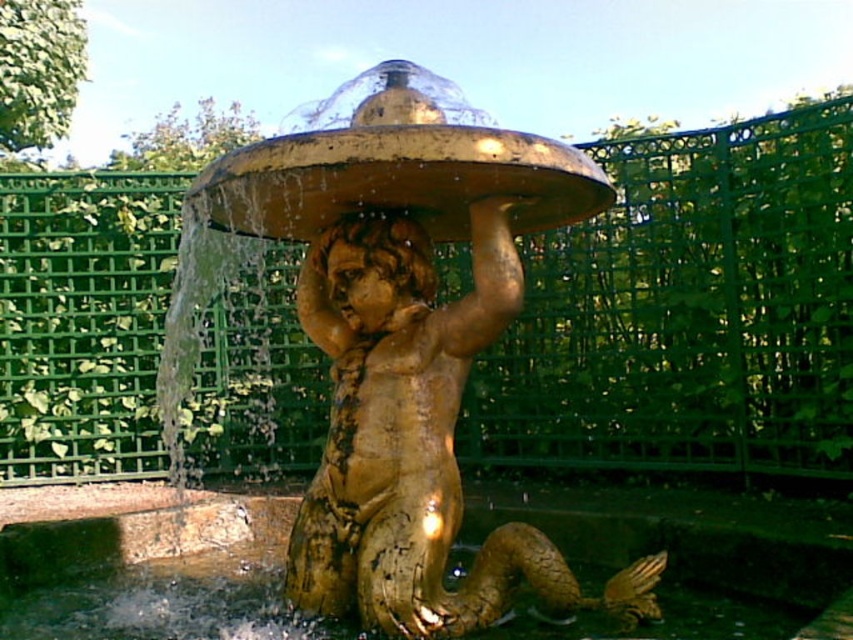
Consider the image. Is gold textured cherub at center smaller than gold metallic water at center?

Actually, gold textured cherub at center might be larger than gold metallic water at center.

Locate an element on the screen. This screenshot has width=853, height=640. gold textured cherub at center is located at coordinates (393, 342).

Does gold textured cherub at center have a greater height compared to golden polished statue head at center?

Indeed, gold textured cherub at center has a greater height compared to golden polished statue head at center.

Looking at this image, which is more to the right, gold textured cherub at center or golden polished statue head at center?

golden polished statue head at center is more to the right.

Which is behind, point (357, 522) or point (405, 230)?

The point (405, 230) is behind.

Where is `gold textured cherub at center`? The width and height of the screenshot is (853, 640). gold textured cherub at center is located at coordinates (393, 342).

Who is shorter, gold metallic water at center or golden polished statue head at center?

gold metallic water at center is shorter.

Is gold metallic water at center to the right of golden polished statue head at center from the viewer's perspective?

No, gold metallic water at center is not to the right of golden polished statue head at center.

Is point (71, 634) behind point (317, 339)?

That is False.

You are a GUI agent. You are given a task and a screenshot of the screen. Output one action in this format:
    pyautogui.click(x=<x>, y=<y>)
    Task: Click on the gold metallic water at center
    The image size is (853, 640).
    Given the screenshot: What is the action you would take?
    pyautogui.click(x=148, y=566)